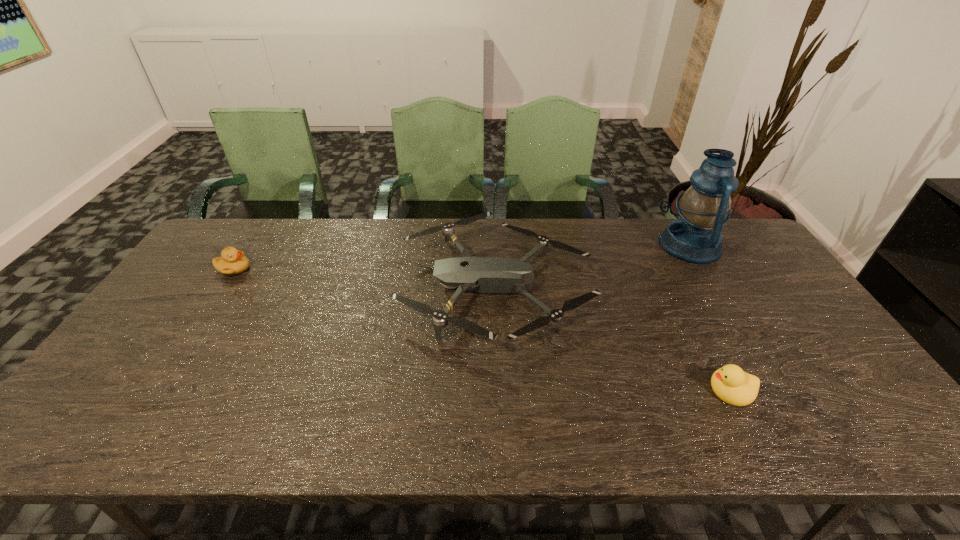
The image size is (960, 540). I want to click on vacant space located 0.300m with a camera mounted on the front of the second object from left to right, so click(300, 286).

The width and height of the screenshot is (960, 540). What are the coordinates of `vacant region located with a camera mounted on the front of the second object from left to right` in the screenshot? It's located at (370, 286).

The height and width of the screenshot is (540, 960). What are the coordinates of `vacant space located 0.380m at the beak of the farther duckling` in the screenshot? It's located at (371, 269).

Image resolution: width=960 pixels, height=540 pixels. In order to click on vacant area located on the face of the nearest object in this screenshot , I will do `click(620, 390)`.

The width and height of the screenshot is (960, 540). Find the location of `free spot located on the face of the nearest object`. free spot located on the face of the nearest object is located at coordinates (562, 390).

Where is `free space located 0.120m on the face of the nearest object`? The height and width of the screenshot is (540, 960). free space located 0.120m on the face of the nearest object is located at coordinates (658, 390).

Where is `lantern that is positioned at the far edge`? The image size is (960, 540). lantern that is positioned at the far edge is located at coordinates (695, 237).

Find the location of a particular element. This screenshot has height=540, width=960. drone situated at the far edge is located at coordinates (482, 275).

Find the location of a particular element. This screenshot has width=960, height=540. duckling that is at the far edge is located at coordinates (232, 261).

Locate an element on the screen. This screenshot has width=960, height=540. object at the left edge is located at coordinates (232, 261).